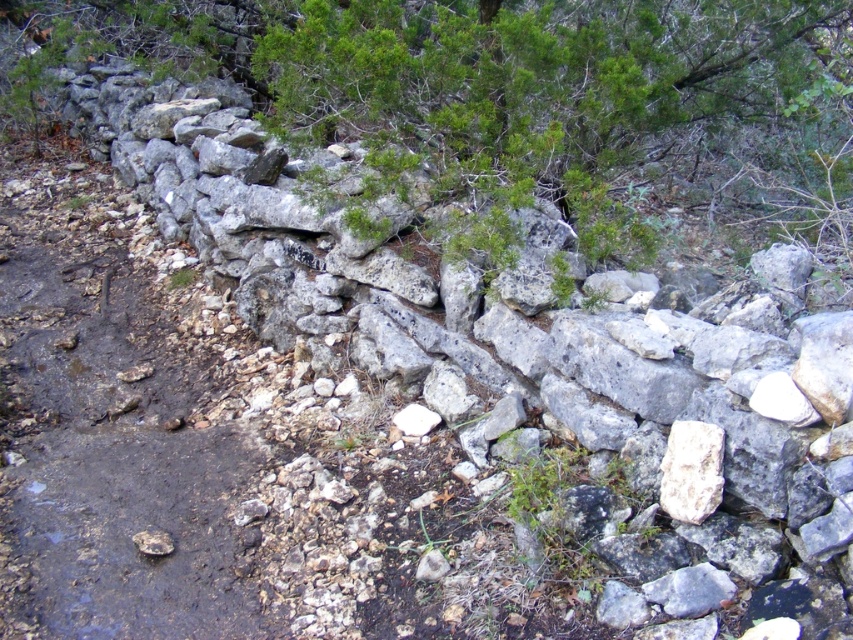
Question: Which point is closer to the camera taking this photo?

Choices:
 (A) (676, 445)
 (B) (152, 600)
 (C) (28, 22)

Answer: (A)

Question: Is green leafy tree at upper center positioned behind dull gray dirt track at center?

Choices:
 (A) yes
 (B) no

Answer: (A)

Question: Can you confirm if dull gray dirt track at center is positioned below white rough rock at center?

Choices:
 (A) yes
 (B) no

Answer: (B)

Question: Which is nearer to the white rough rock at center?

Choices:
 (A) dull gray dirt track at center
 (B) green leafy tree at upper center

Answer: (B)

Question: Which of the following is the farthest from the observer?

Choices:
 (A) (151, 300)
 (B) (676, 465)

Answer: (A)

Question: Can you confirm if green leafy tree at upper center is positioned to the right of dull gray dirt track at center?

Choices:
 (A) yes
 (B) no

Answer: (A)